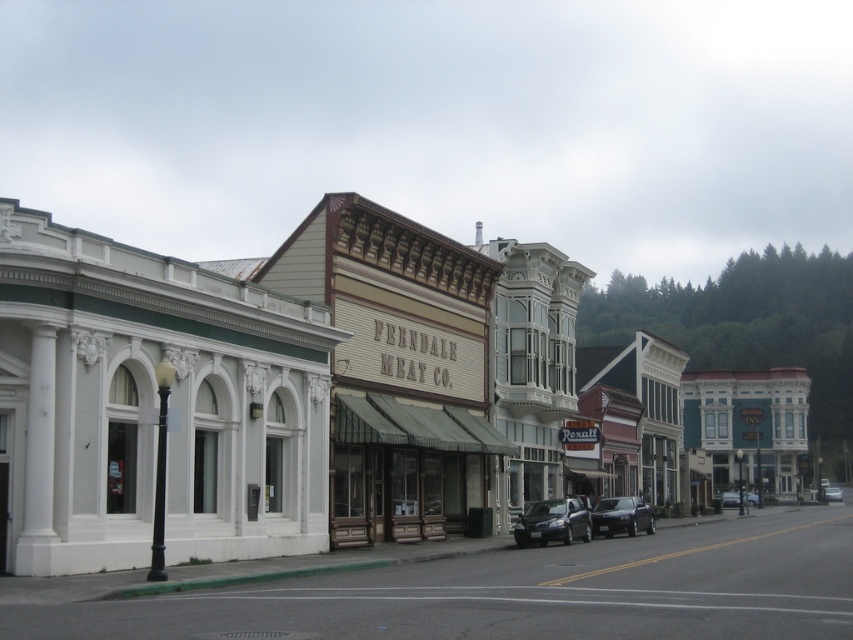
Can you confirm if white painted building at center is positioned below shiny dark blue sedan at center?

No.

Is the position of white painted building at center more distant than that of shiny dark blue sedan at center?

No, white painted building at center is in front of shiny dark blue sedan at center.

Does point (390, 291) come farther from viewer compared to point (583, 536)?

No, (390, 291) is in front of (583, 536).

Identify the location of white painted building at center. The width and height of the screenshot is (853, 640). (265, 392).

Is the position of white painted building at center more distant than that of metallic blue sedan at center?

No, it is in front of metallic blue sedan at center.

From the picture: Can you confirm if white painted building at center is positioned to the left of metallic blue sedan at center?

Correct, you'll find white painted building at center to the left of metallic blue sedan at center.

Who is more forward, (38, 385) or (723, 502)?

Point (38, 385) is in front.

You are a GUI agent. You are given a task and a screenshot of the screen. Output one action in this format:
    pyautogui.click(x=<x>, y=<y>)
    Task: Click on the white painted building at center
    
    Given the screenshot: What is the action you would take?
    click(265, 392)

Does shiny black sedan at center have a greater width compared to silver metallic sedan at center?

No, shiny black sedan at center is not wider than silver metallic sedan at center.

Identify the location of shiny black sedan at center. (621, 516).

The image size is (853, 640). What do you see at coordinates (621, 516) in the screenshot?
I see `shiny black sedan at center` at bounding box center [621, 516].

What are the coordinates of `shiny black sedan at center` in the screenshot? It's located at (621, 516).